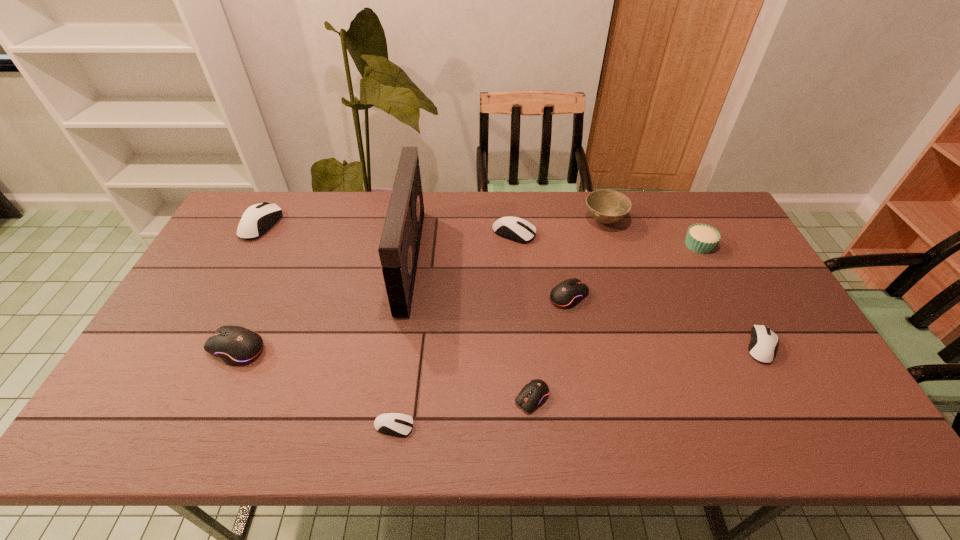
This screenshot has width=960, height=540. Find the location of `unoccupied area between the cupcake and the biggest white mouse`. unoccupied area between the cupcake and the biggest white mouse is located at coordinates (480, 235).

This screenshot has height=540, width=960. In order to click on free space between the second farthest black computer mouse and the second white mouse from left to right in this screenshot , I will do `click(316, 387)`.

You are a GUI agent. You are given a task and a screenshot of the screen. Output one action in this format:
    pyautogui.click(x=<x>, y=<y>)
    Task: Click on the vacant area that lies between the second tallest object and the second nearest mouse
    Image resolution: width=960 pixels, height=540 pixels.
    Given the screenshot: What is the action you would take?
    pyautogui.click(x=568, y=309)

This screenshot has height=540, width=960. I want to click on free space between the rightmost mouse and the shortest object, so click(x=578, y=386).

Identify the location of free space between the second white mouse from right to left and the black videotape. This screenshot has width=960, height=540. (462, 246).

Find the location of a particular element. vacant space that is in between the second white mouse from left to right and the second white mouse from right to left is located at coordinates (454, 329).

Where is `the closest object relative to the ninth shortest object`? the closest object relative to the ninth shortest object is located at coordinates (701, 238).

Locate which object ranks third in proximity to the nearest mouse. Please provide its 2D coordinates. Your answer should be formatted as a tuple, i.e. [(x, y)], where the tuple contains the x and y coordinates of a point satisfying the conditions above.

[(235, 345)]

Find the location of `the seventh closest mouse to the black videotape`. the seventh closest mouse to the black videotape is located at coordinates (763, 344).

The image size is (960, 540). I want to click on mouse object that ranks as the second closest to the eighth object from left to right, so click(x=567, y=294).